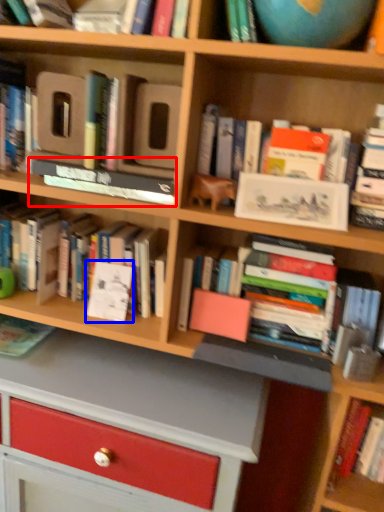
Question: Among these objects, which one is nearest to the camera, book (highlighted by a red box) or paperback book (highlighted by a blue box)?

Choices:
 (A) book
 (B) paperback book

Answer: (A)